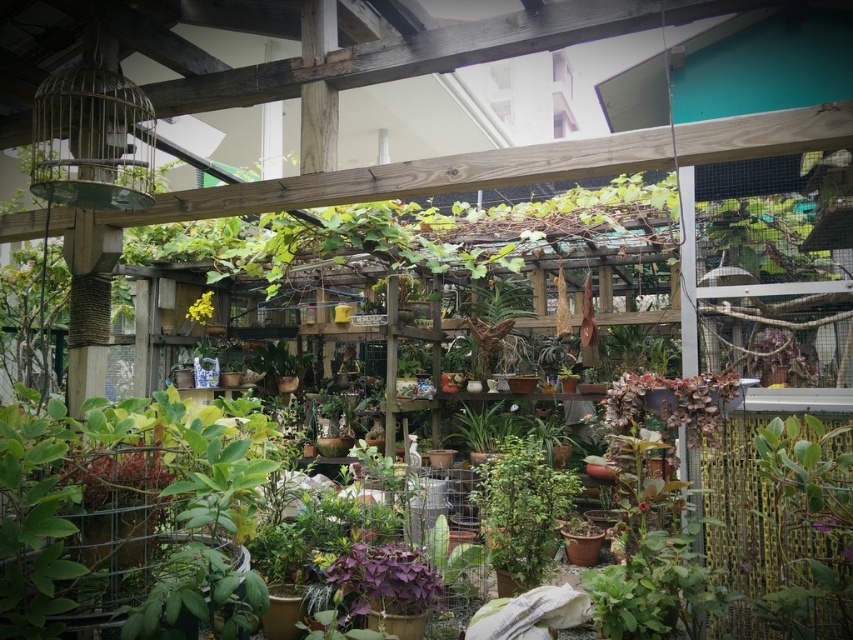
Between green matte plant at center and yellow matte flower at center, which one has less height?

yellow matte flower at center

Is green matte plant at center shorter than yellow matte flower at center?

No.

Find the location of `green matte plant at center`. green matte plant at center is located at coordinates (521, 508).